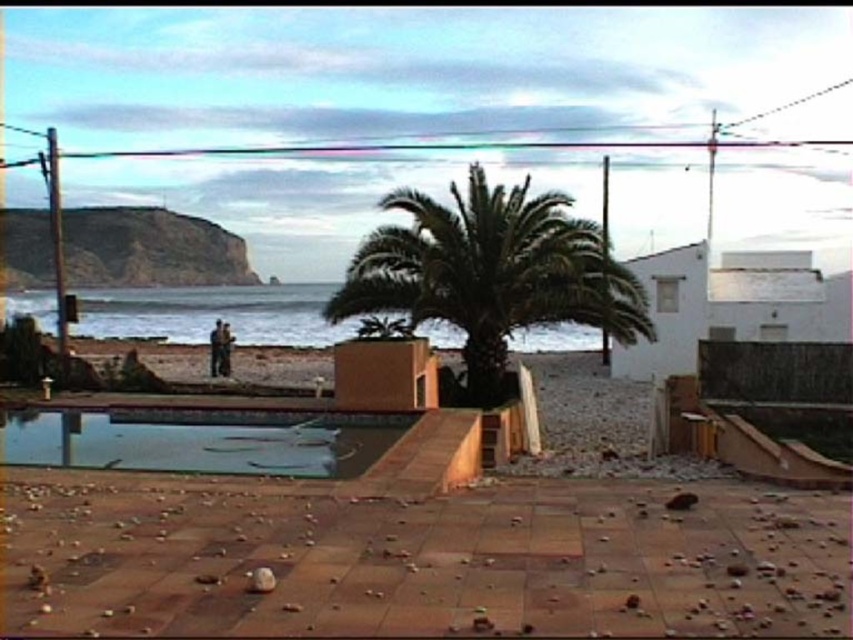
Which is more to the left, green leafy palm tree at center or transparent glass pool at center?

From the viewer's perspective, transparent glass pool at center appears more on the left side.

Who is more forward, (403, 195) or (227, 448)?

Point (227, 448) is more forward.

Where is `green leafy palm tree at center`? green leafy palm tree at center is located at coordinates (491, 273).